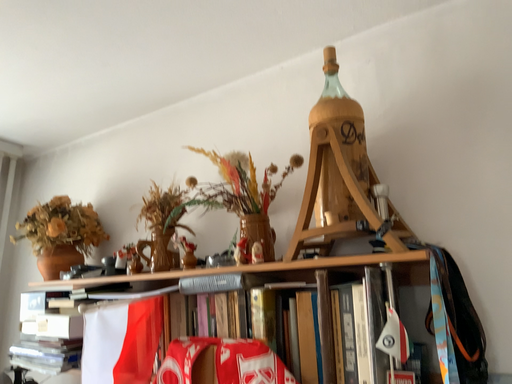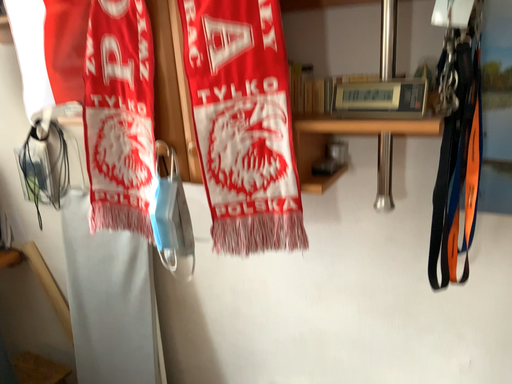
Question: Which way did the camera rotate in the video?

Choices:
 (A) rotated downward
 (B) rotated upward

Answer: (A)